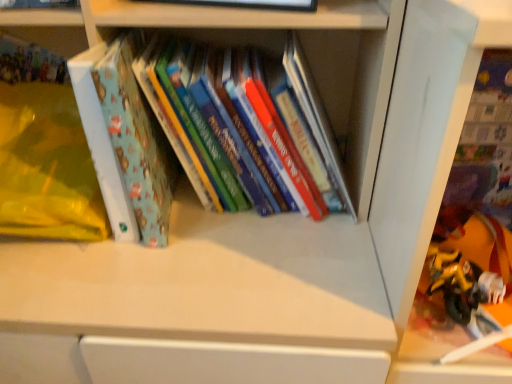
Question: Is yellow matte toy at lower right beside matte blue book at left?

Choices:
 (A) yes
 (B) no

Answer: (B)

Question: From a real-world perspective, is yellow matte toy at lower right on matte blue book at left?

Choices:
 (A) yes
 (B) no

Answer: (B)

Question: Is matte blue book at left completely or partially inside yellow matte toy at lower right?

Choices:
 (A) yes
 (B) no

Answer: (B)

Question: Considering the relative sizes of yellow matte toy at lower right and matte blue book at left in the image provided, is yellow matte toy at lower right smaller than matte blue book at left?

Choices:
 (A) no
 (B) yes

Answer: (B)

Question: Considering the relative positions of yellow matte toy at lower right and matte blue book at left in the image provided, is yellow matte toy at lower right in front of matte blue book at left?

Choices:
 (A) yes
 (B) no

Answer: (B)

Question: Would you say yellow matte toy at lower right is to the left or to the right of hardcover books at center, the 1th book in the right-to-left sequence, in the picture?

Choices:
 (A) left
 (B) right

Answer: (B)

Question: Is yellow matte toy at lower right bigger or smaller than hardcover books at center, the 2th book when ordered from left to right?

Choices:
 (A) small
 (B) big

Answer: (A)

Question: From a real-world perspective, relative to hardcover books at center, the second book in the top-to-bottom sequence, is yellow matte toy at lower right vertically above or below?

Choices:
 (A) above
 (B) below

Answer: (B)

Question: Is point (455, 283) closer or farther from the camera than point (203, 205)?

Choices:
 (A) closer
 (B) farther

Answer: (A)

Question: Is matte blue book at left wider or thinner than matte blue book at upper left, which is the 2th book from right to left?

Choices:
 (A) wide
 (B) thin

Answer: (A)

Question: Is matte blue book at left taller or shorter than matte blue book at upper left, placed as the 1th book when sorted from left to right?

Choices:
 (A) tall
 (B) short

Answer: (A)

Question: Would you say matte blue book at left is inside or outside matte blue book at upper left, which is the 2th book from right to left?

Choices:
 (A) inside
 (B) outside

Answer: (B)

Question: From a real-world perspective, is matte blue book at left positioned above or below matte blue book at upper left, the first book from the top?

Choices:
 (A) below
 (B) above

Answer: (A)

Question: From the image's perspective, is matte blue book at left located above or below yellow matte toy at lower right?

Choices:
 (A) below
 (B) above

Answer: (B)

Question: From a real-world perspective, is matte blue book at left positioned above or below yellow matte toy at lower right?

Choices:
 (A) below
 (B) above

Answer: (B)